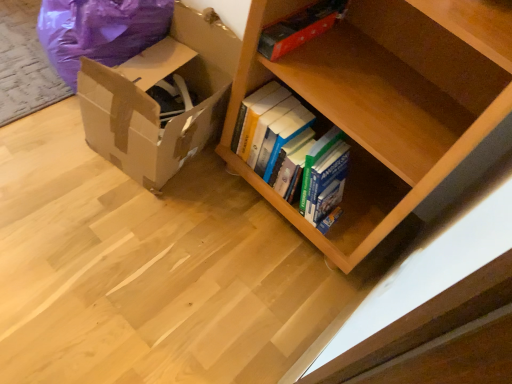
Where is `free point in front of brown cardboard box at lower left`? Image resolution: width=512 pixels, height=384 pixels. free point in front of brown cardboard box at lower left is located at coordinates (117, 213).